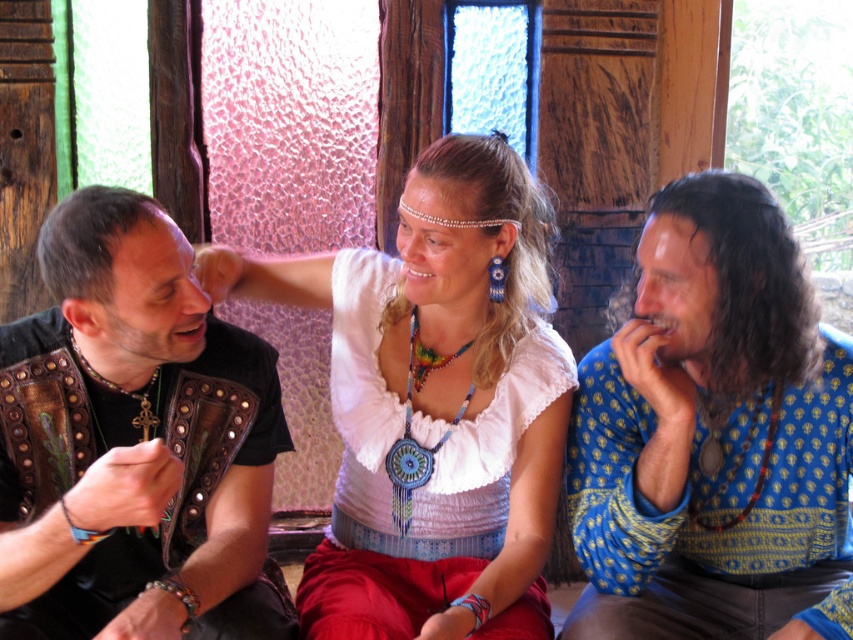
Looking at this image, between white fabric blouse at center and rainbow beaded necklace at center, which one is positioned lower?

white fabric blouse at center is lower down.

Does point (408, 253) lie behind point (412, 332)?

No, it is in front of (412, 332).

In order to click on white fabric blouse at center in this screenshot , I will do `click(434, 404)`.

Based on the photo, does blue printed shirt at center lie in front of leather vest at left?

No, blue printed shirt at center is further to the viewer.

Based on the photo, who is higher up, blue printed shirt at center or leather vest at left?

blue printed shirt at center

Where is `blue printed shirt at center`? blue printed shirt at center is located at coordinates (714, 435).

How far apart are white fabric blouse at center and leather vest at left?

white fabric blouse at center and leather vest at left are 26.64 centimeters apart.

Between white fabric blouse at center and leather vest at left, which one has less height?

leather vest at left

Identify the location of white fabric blouse at center. (434, 404).